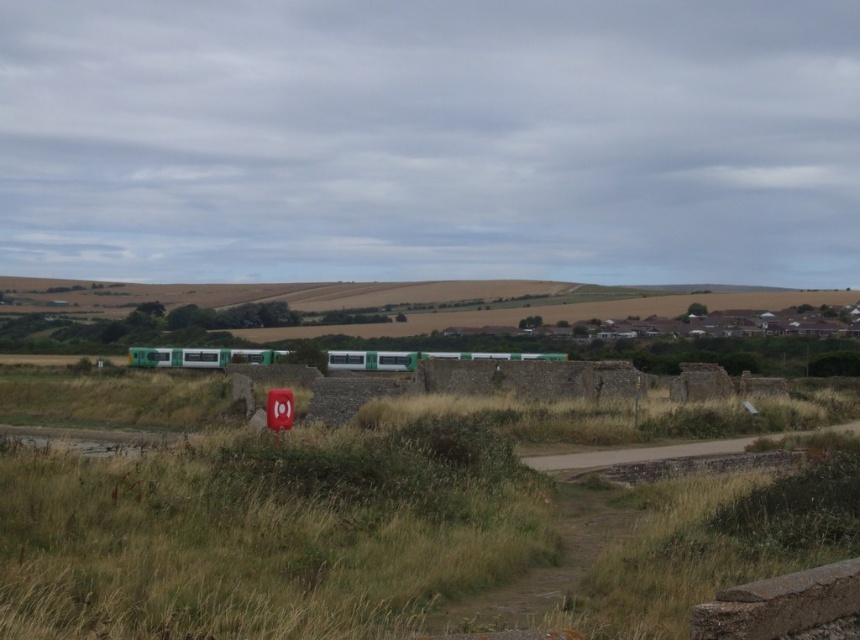
You are driving a car on the dirt road at center and want to see the smooth plastic sign at center. Can you see it from your current position?

The smooth plastic sign at center is behind the dirt road at center, so it is obstructed and cannot be seen from the current position on the dirt road at center.

You are a photographer planning to capture the green matte passenger train at center and the dirt road at center in a single frame. Given their relative sizes, which object will occupy more space in your photo?

The green matte passenger train at center has a greater width than the dirt road at center, so it will occupy more space in the photo.

You are a photographer trying to capture the smooth plastic sign at center without the green matte passenger train at center blocking it. Based on their sizes, is this possible?

The green matte passenger train at center might be wider than smooth plastic sign at center, so there is a possibility that the train could block the sign if they are aligned in a way that their widths overlap. To ensure the sign is visible, you might need to adjust your angle or position to avoid the train obstructing it.